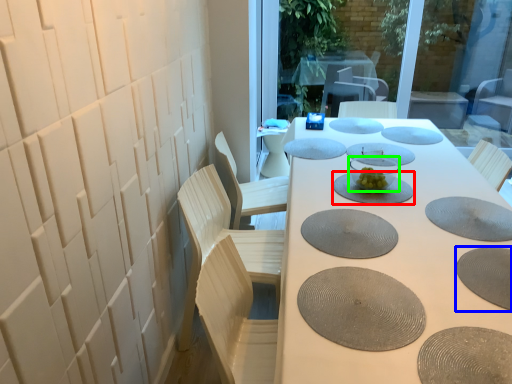
Question: Which object is the farthest from manhole cover (highlighted by a red box)? Choose among these: manhole cover (highlighted by a blue box) or tableware (highlighted by a green box).

Choices:
 (A) manhole cover
 (B) tableware

Answer: (A)